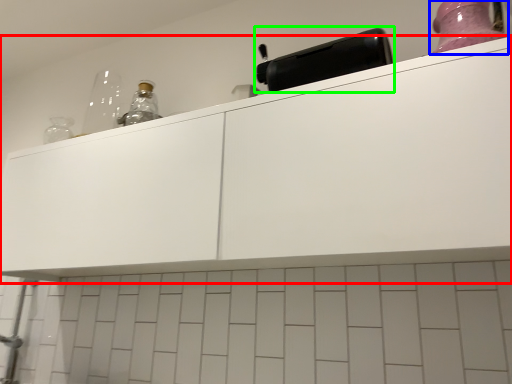
Question: Which is farther away from cabinetry (highlighted by a red box)? bottle (highlighted by a blue box) or appliance (highlighted by a green box)?

Choices:
 (A) bottle
 (B) appliance

Answer: (A)